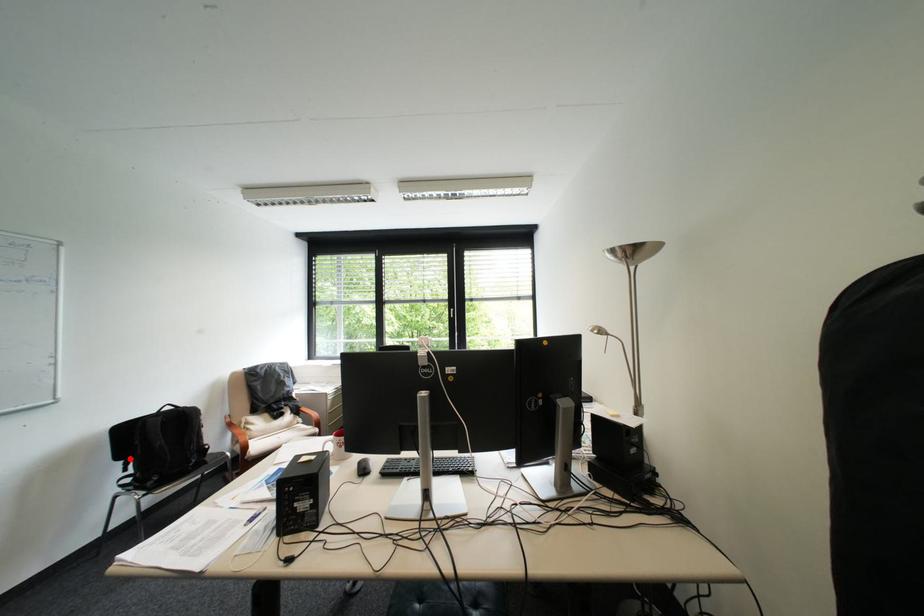
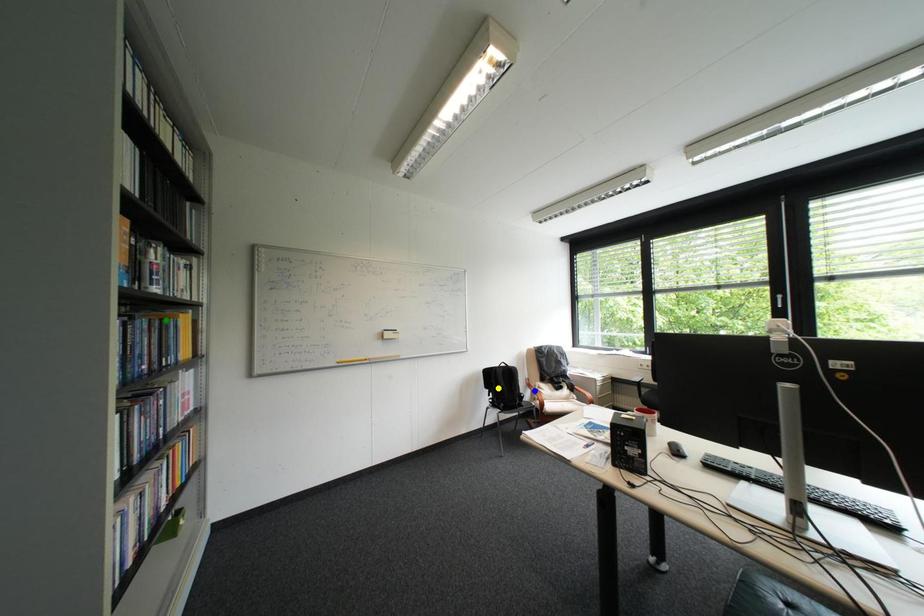
Question: I am providing you with two images of the same scene from different viewpoints. A red point is marked on the first image. You are given multiple points on the second image. Which spot in image 2 lines up with the point in image 1?

Choices:
 (A) yellow point
 (B) blue point
 (C) green point

Answer: (A)